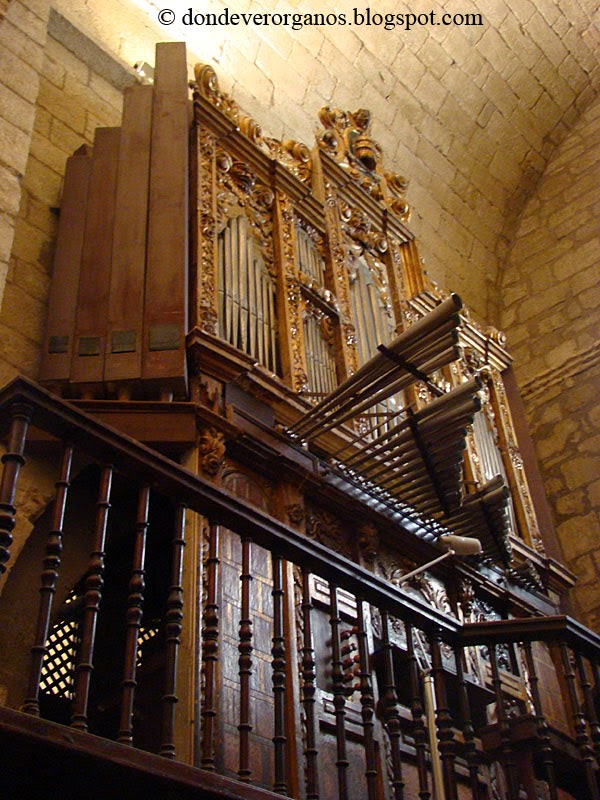
Find the location of a particular element. This screenshot has height=800, width=600. wooden wall is located at coordinates (255, 486).